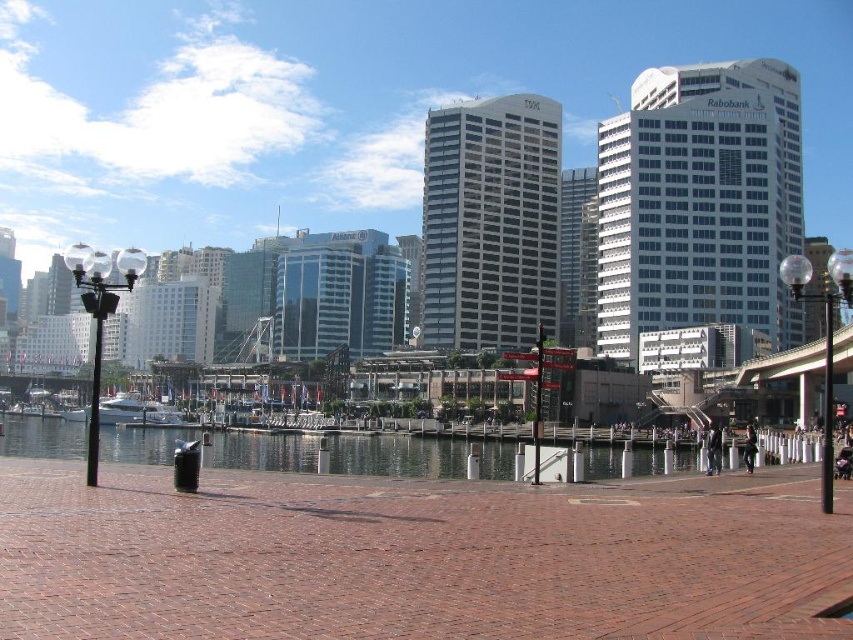
Does point (151, 460) come behind point (158, 404)?

No.

Between clear water at center and white glossy boat at center, which one is positioned lower?

Positioned lower is clear water at center.

This screenshot has height=640, width=853. I want to click on clear water at center, so click(x=416, y=456).

The image size is (853, 640). I want to click on clear water at center, so click(x=416, y=456).